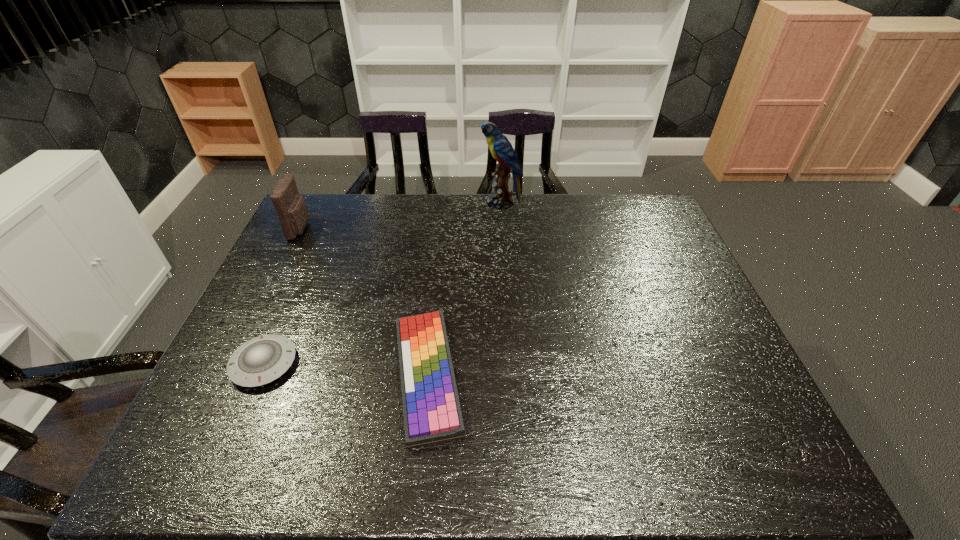
The height and width of the screenshot is (540, 960). I want to click on free space between the saucer and the third object from left to right, so coord(346,369).

Find the location of a particular element. vacant region between the saucer and the parrot is located at coordinates (382, 284).

In order to click on vacant area that lies between the pouch and the second object from right to left in this screenshot , I will do `click(364, 302)`.

Find the location of `object that is the second nearest to the second object from right to left`. object that is the second nearest to the second object from right to left is located at coordinates (290, 207).

Select which object appears as the closest to the third shortest object. Please provide its 2D coordinates. Your answer should be formatted as a tuple, i.e. [(x, y)], where the tuple contains the x and y coordinates of a point satisfying the conditions above.

[(261, 360)]

Find the location of a particular element. free space that satisfies the following two spatial constraints: 1. with an open flap on the third object from left to right; 2. on the left side of the second farthest object is located at coordinates (228, 375).

Identify the location of free space that satisfies the following two spatial constraints: 1. with an open flap on the third object from left to right; 2. on the left side of the second farthest object. Image resolution: width=960 pixels, height=540 pixels. (228, 375).

What are the coordinates of `free location that satisfies the following two spatial constraints: 1. with an open flap on the pouch; 2. on the right side of the saucer` in the screenshot? It's located at (233, 364).

The width and height of the screenshot is (960, 540). Identify the location of vacant space that satisfies the following two spatial constraints: 1. with an open flap on the pouch; 2. on the left side of the saucer. (233, 364).

The width and height of the screenshot is (960, 540). Identify the location of free space that satisfies the following two spatial constraints: 1. on the back side of the third object from left to right; 2. with an open flap on the second farthest object. (443, 228).